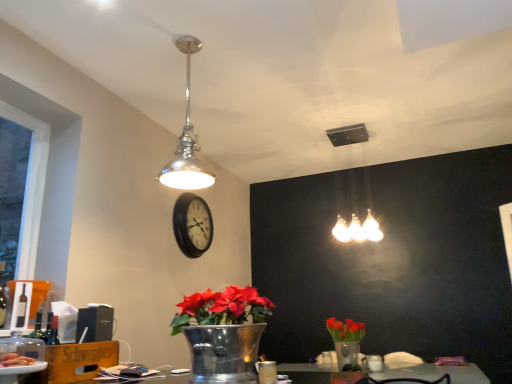
Question: From the image's perspective, does translucent plastic plate at lower left appear higher than black wooden clock at center?

Choices:
 (A) yes
 (B) no

Answer: (B)

Question: From a real-world perspective, does translucent plastic plate at lower left sit lower than black wooden clock at center?

Choices:
 (A) no
 (B) yes

Answer: (B)

Question: Is black wooden clock at center inside translucent plastic plate at lower left?

Choices:
 (A) yes
 (B) no

Answer: (B)

Question: Considering the relative sizes of translucent plastic plate at lower left and black wooden clock at center in the image provided, is translucent plastic plate at lower left shorter than black wooden clock at center?

Choices:
 (A) yes
 (B) no

Answer: (A)

Question: Considering the relative sizes of translucent plastic plate at lower left and black wooden clock at center in the image provided, is translucent plastic plate at lower left taller than black wooden clock at center?

Choices:
 (A) yes
 (B) no

Answer: (B)

Question: Does translucent plastic plate at lower left turn towards black wooden clock at center?

Choices:
 (A) yes
 (B) no

Answer: (B)

Question: Is the surface of black wooden clock at center in direct contact with polished chrome pendant light at upper center, positioned as the 1th lamp in front-to-back order?

Choices:
 (A) yes
 (B) no

Answer: (B)

Question: From a real-world perspective, is black wooden clock at center on polished chrome pendant light at upper center, positioned as the 1th lamp in front-to-back order?

Choices:
 (A) yes
 (B) no

Answer: (B)

Question: Does black wooden clock at center appear on the left side of polished chrome pendant light at upper center, marked as the 1th lamp in a left-to-right arrangement?

Choices:
 (A) no
 (B) yes

Answer: (B)

Question: From the image's perspective, is black wooden clock at center located above polished chrome pendant light at upper center, positioned as the 2th lamp in back-to-front order?

Choices:
 (A) no
 (B) yes

Answer: (A)

Question: Is black wooden clock at center surrounding polished chrome pendant light at upper center, the second lamp from the right?

Choices:
 (A) yes
 (B) no

Answer: (B)

Question: Is black wooden clock at center taller than polished chrome pendant light at upper center, positioned as the 2th lamp in back-to-front order?

Choices:
 (A) no
 (B) yes

Answer: (A)

Question: Is black wooden clock at center located within white frosted glass light fixture at upper center, which appears as the 1th lamp when viewed from the back?

Choices:
 (A) yes
 (B) no

Answer: (B)